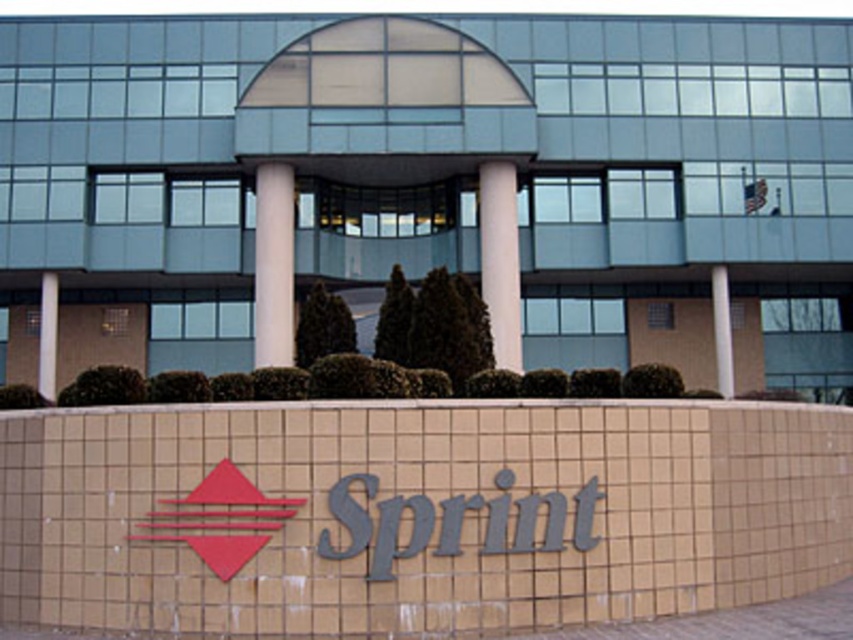
Question: Among these objects, which one is nearest to the camera?

Choices:
 (A) white concrete pillar at center
 (B) white smooth column at center

Answer: (B)

Question: Is the position of white smooth pillar at center less distant than that of white concrete pillar at center?

Choices:
 (A) no
 (B) yes

Answer: (B)

Question: Is white smooth column at center further to camera compared to white concrete pillar at center?

Choices:
 (A) no
 (B) yes

Answer: (A)

Question: Among these points, which one is farthest from the camera?

Choices:
 (A) (726, 387)
 (B) (267, 228)

Answer: (A)

Question: Can you confirm if white concrete pillar at center is bigger than white concrete pillar at left?

Choices:
 (A) no
 (B) yes

Answer: (B)

Question: Which of the following is the farthest from the observer?

Choices:
 (A) white concrete pillar at center
 (B) white concrete pillar at left

Answer: (A)